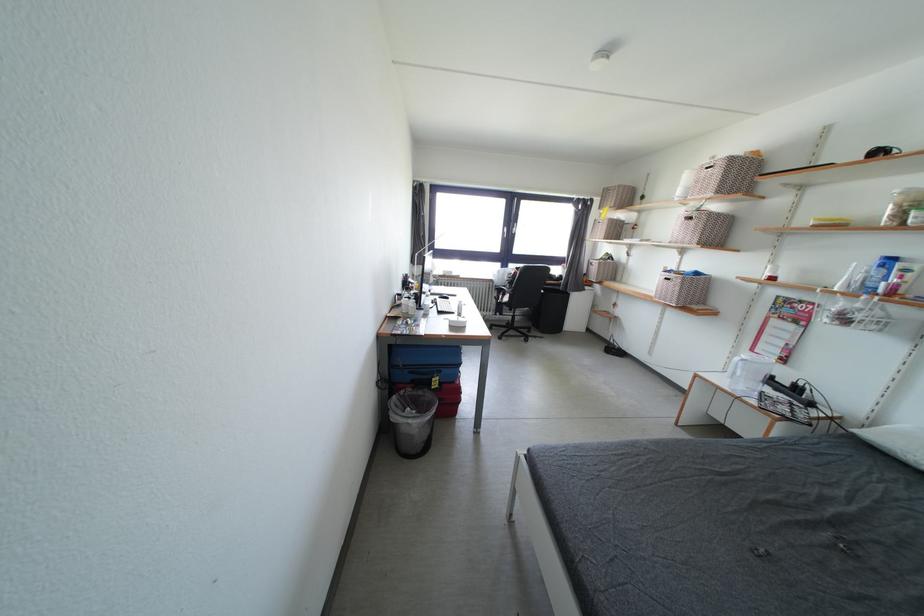
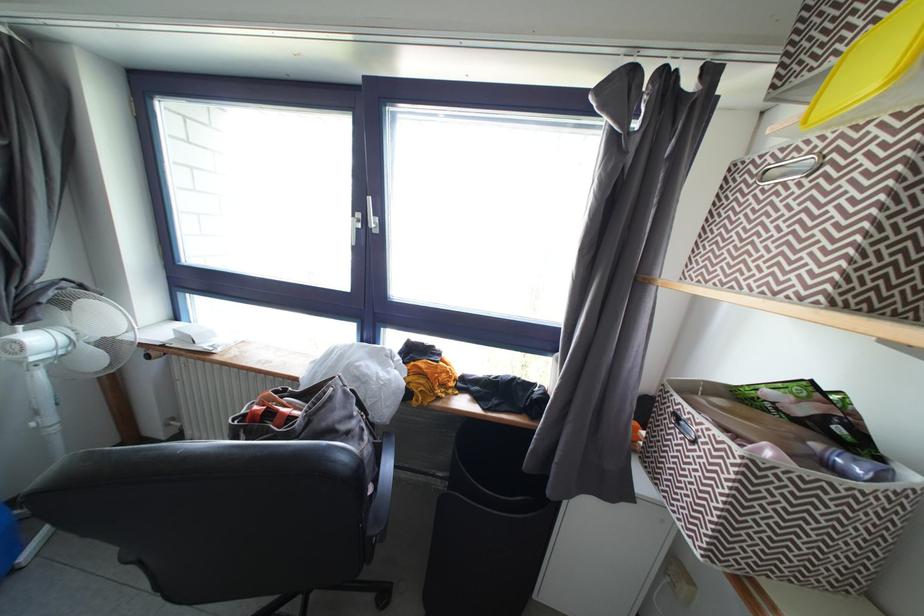
What movement of the cameraman would produce the second image?

The movement direction of the cameraman is right, forward.